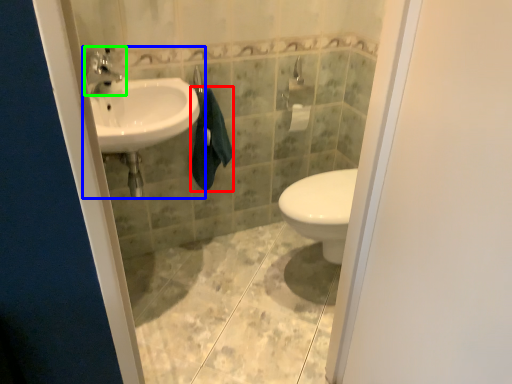
Question: Based on their relative distances, which object is farther from bath towel (highlighted by a red box)? Choose from sink (highlighted by a blue box) and tap (highlighted by a green box).

Choices:
 (A) sink
 (B) tap

Answer: (B)